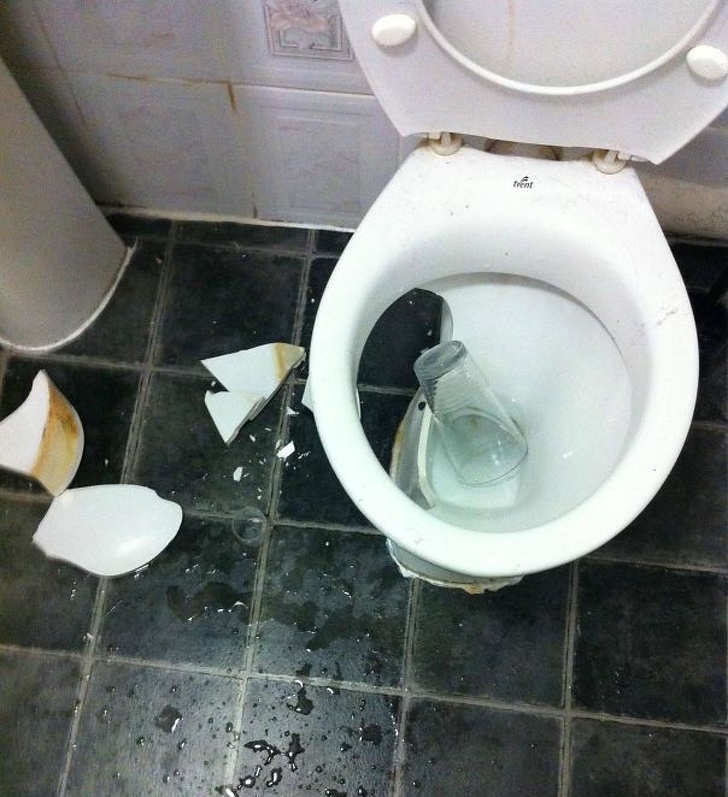
Find the location of a particular element. This screenshot has width=728, height=797. toilet is located at coordinates (528, 206).